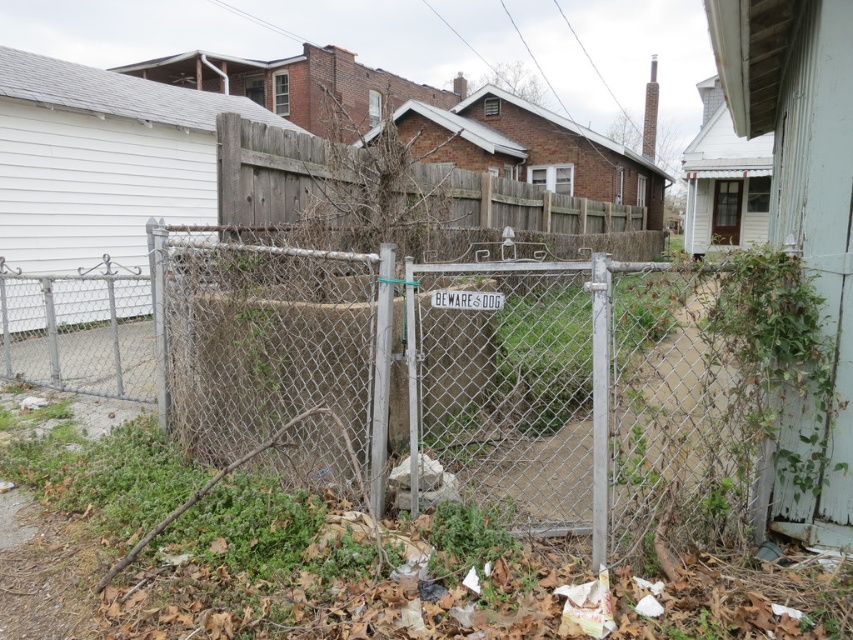
In the scene shown: You are standing at the point marked as point (726, 220) in the residential area. You want to walk straight towards the viewer. How far will you have to walk to reach the viewer?

You are currently at point (726, 220), and the viewer is 20.41 meters away. If you walk straight towards the viewer, you will have to walk 20.41 meters to reach them.

You are standing in front of the fenced yard and want to determine the relative positions of two points marked in the scene. Which point is closer to you, point (712,202) or point (453,301)?

Point (453,301) is closer to you because it is less further to the viewer than point (712,202).